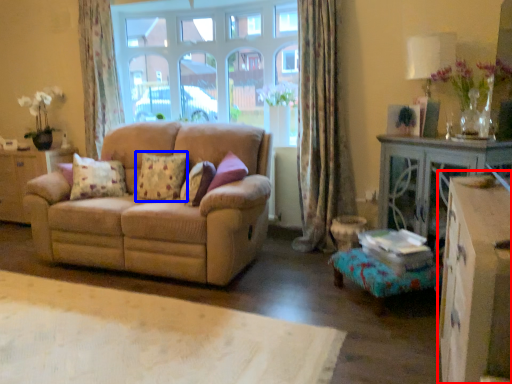
Question: Which object is further to the camera taking this photo, dresser (highlighted by a red box) or pillow (highlighted by a blue box)?

Choices:
 (A) dresser
 (B) pillow

Answer: (B)